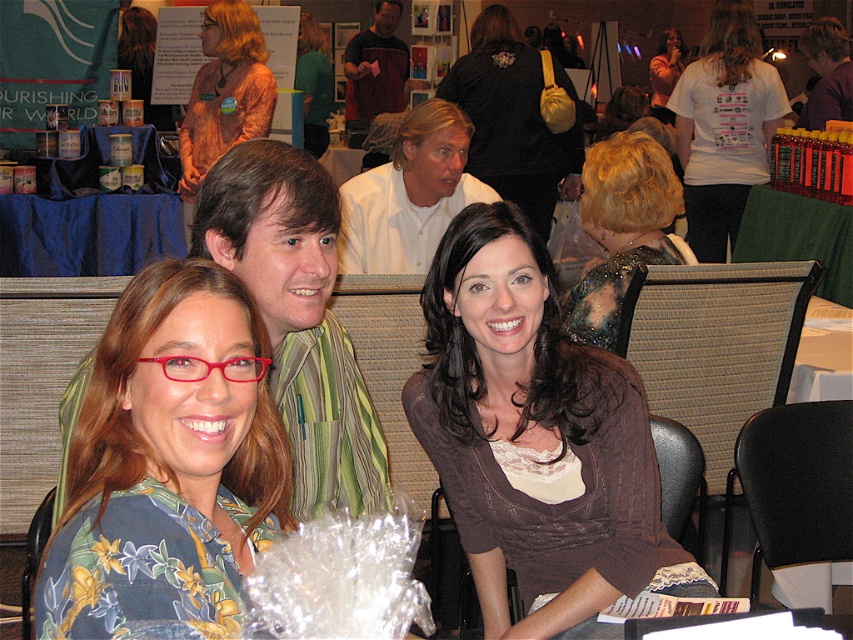
Question: Which object appears farthest from the camera in this image?

Choices:
 (A) white matte t-shirt at upper right
 (B) green fabric shirt at upper center

Answer: (B)

Question: Is brown lace top at center wider than matte white blouse at upper center?

Choices:
 (A) yes
 (B) no

Answer: (B)

Question: Can you confirm if green striped shirt at center is positioned to the left of matte black jacket at upper center?

Choices:
 (A) no
 (B) yes

Answer: (B)

Question: Can you confirm if white button-down shirt at center is wider than green fabric shirt at upper center?

Choices:
 (A) no
 (B) yes

Answer: (B)

Question: Among these points, which one is nearest to the camera?

Choices:
 (A) (537, 561)
 (B) (666, 168)

Answer: (A)

Question: Which of the following is the closest to the observer?

Choices:
 (A) tap(229, 108)
 (B) tap(103, 563)

Answer: (B)